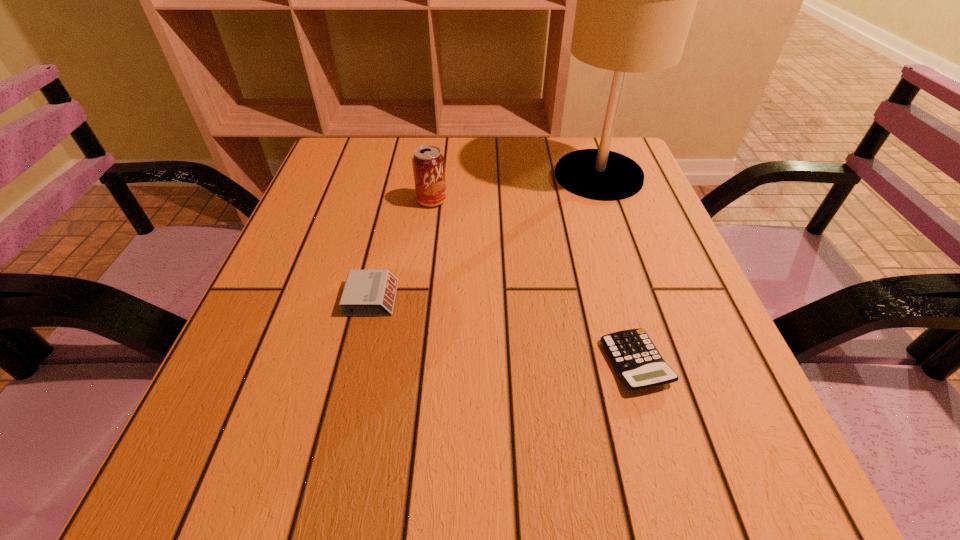
Where is `vacant space at the far left corner of the desktop`? vacant space at the far left corner of the desktop is located at coordinates (348, 144).

The height and width of the screenshot is (540, 960). In the image, there is a desktop. What are the coordinates of `free space at the far right corner` in the screenshot? It's located at (570, 140).

What are the coordinates of `vacant region between the soda can and the leftmost object` in the screenshot? It's located at (401, 249).

The height and width of the screenshot is (540, 960). Find the location of `free space between the soda can and the table lamp`. free space between the soda can and the table lamp is located at coordinates (516, 188).

Locate an element on the screen. Image resolution: width=960 pixels, height=540 pixels. vacant point located between the alarm clock and the calculator is located at coordinates (503, 330).

Where is `vacant space in between the nearest object and the second shortest object`? vacant space in between the nearest object and the second shortest object is located at coordinates (503, 330).

In order to click on free space between the nearest object and the soda can in this screenshot , I will do `click(534, 281)`.

This screenshot has width=960, height=540. Identify the location of free space between the third shortest object and the calculator. (534, 281).

This screenshot has width=960, height=540. What are the coordinates of `free space between the tallest object and the third shortest object` in the screenshot? It's located at (516, 188).

I want to click on vacant region between the second nearest object and the tallest object, so click(x=485, y=237).